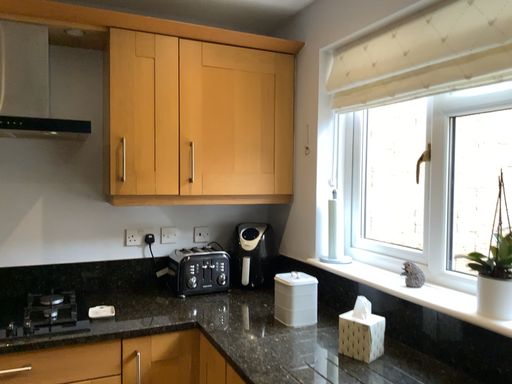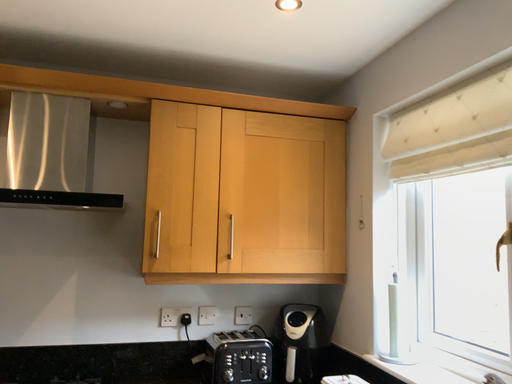
Question: How did the camera likely rotate when shooting the video?

Choices:
 (A) rotated upward
 (B) rotated downward

Answer: (A)